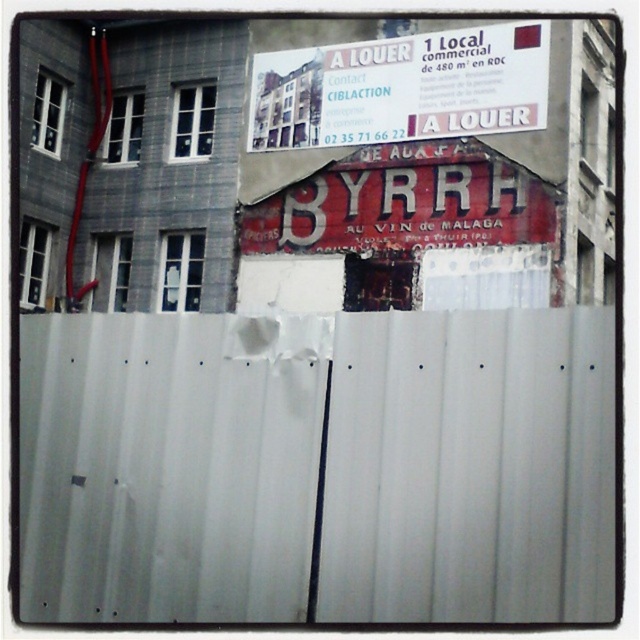
Based on the scene description, what are the coordinates of the white corrugated metal fence at center?

The white corrugated metal fence at center is located at coordinates point (317, 468).

You are a delivery driver who needs to see the contact number on the white paper sign at upper center. However, the white corrugated metal fence at center might be blocking your view. Can you see the contact number clearly?

The white corrugated metal fence at center is taller than the white paper sign at upper center, so the fence may block the view of the contact number on the sign.

You are a delivery driver who needs to see the address on the red painted wooden signboard at center. Can you see the address clearly over the white corrugated metal fence at center?

The white corrugated metal fence at center is shorter than the red painted wooden signboard at center, so yes, you can see the address on the red painted wooden signboard at center clearly over the white corrugated metal fence at center.